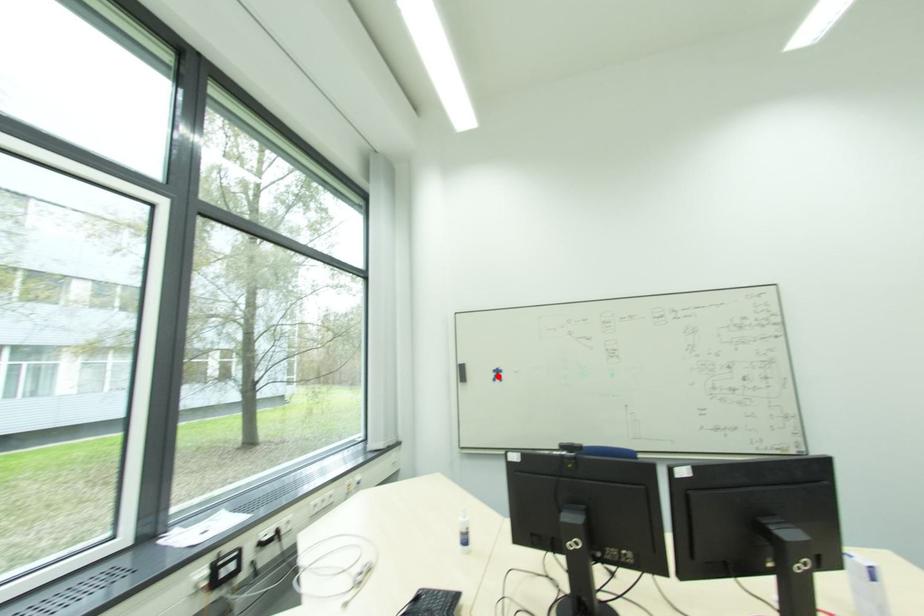
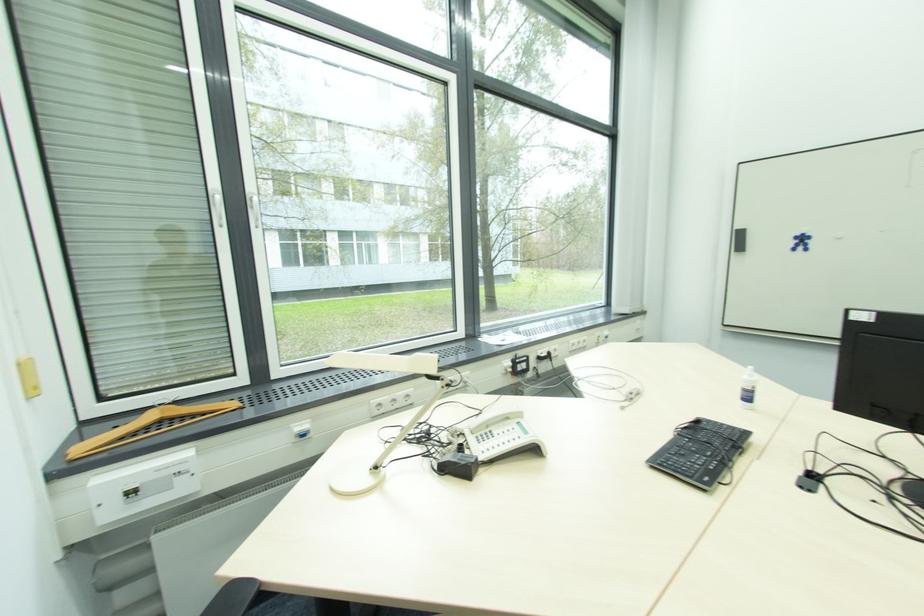
Where in the second image is the point corresponding to the highlighted location from the first image?

(801, 244)